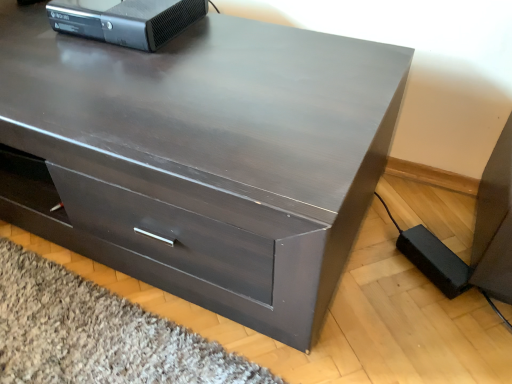
Question: Should I look upward or downward to see black plastic xbox 360 at upper left?

Choices:
 (A) up
 (B) down

Answer: (A)

Question: Is matte dark wood chest of drawers at center located outside black plastic xbox 360 at upper left?

Choices:
 (A) yes
 (B) no

Answer: (A)

Question: Is matte dark wood chest of drawers at center directly adjacent to black plastic xbox 360 at upper left?

Choices:
 (A) yes
 (B) no

Answer: (B)

Question: From a real-world perspective, is matte dark wood chest of drawers at center over black plastic xbox 360 at upper left?

Choices:
 (A) no
 (B) yes

Answer: (A)

Question: Considering the relative sizes of matte dark wood chest of drawers at center and black plastic xbox 360 at upper left in the image provided, is matte dark wood chest of drawers at center smaller than black plastic xbox 360 at upper left?

Choices:
 (A) yes
 (B) no

Answer: (B)

Question: Is matte dark wood chest of drawers at center facing away from black plastic xbox 360 at upper left?

Choices:
 (A) no
 (B) yes

Answer: (A)

Question: Considering the relative positions of matte dark wood chest of drawers at center and black plastic xbox 360 at upper left in the image provided, is matte dark wood chest of drawers at center to the right of black plastic xbox 360 at upper left from the viewer's perspective?

Choices:
 (A) no
 (B) yes

Answer: (A)

Question: Can you confirm if black plastic xbox 360 at upper left is shorter than matte dark wood chest of drawers at center?

Choices:
 (A) yes
 (B) no

Answer: (A)

Question: From the image's perspective, would you say black plastic xbox 360 at upper left is shown under matte dark wood chest of drawers at center?

Choices:
 (A) yes
 (B) no

Answer: (B)

Question: Is black plastic xbox 360 at upper left positioned with its back to matte dark wood chest of drawers at center?

Choices:
 (A) yes
 (B) no

Answer: (B)

Question: Is the depth of black plastic xbox 360 at upper left less than that of matte dark wood chest of drawers at center?

Choices:
 (A) yes
 (B) no

Answer: (B)

Question: From a real-world perspective, is black plastic xbox 360 at upper left positioned over matte dark wood chest of drawers at center based on gravity?

Choices:
 (A) yes
 (B) no

Answer: (A)

Question: Is the surface of black plastic xbox 360 at upper left in direct contact with matte dark wood chest of drawers at center?

Choices:
 (A) no
 (B) yes

Answer: (A)

Question: Is black plastic xbox 360 at upper left taller or shorter than matte dark wood chest of drawers at center?

Choices:
 (A) short
 (B) tall

Answer: (A)